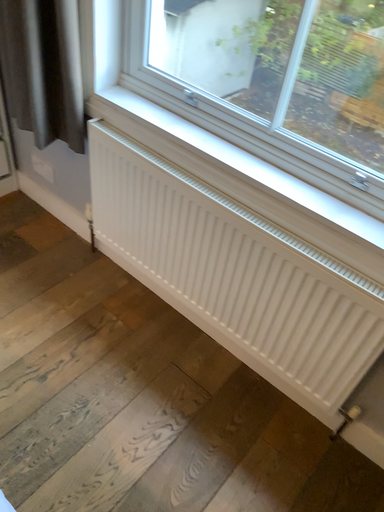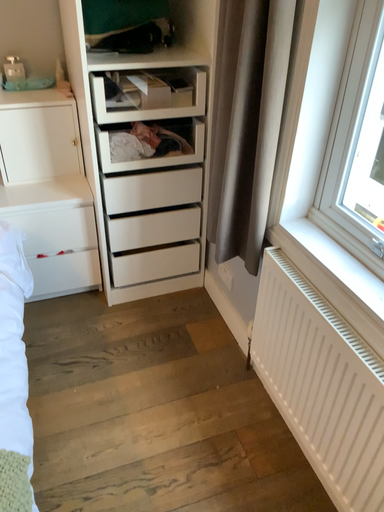
Question: Which way did the camera rotate in the video?

Choices:
 (A) rotated downward
 (B) rotated upward

Answer: (B)